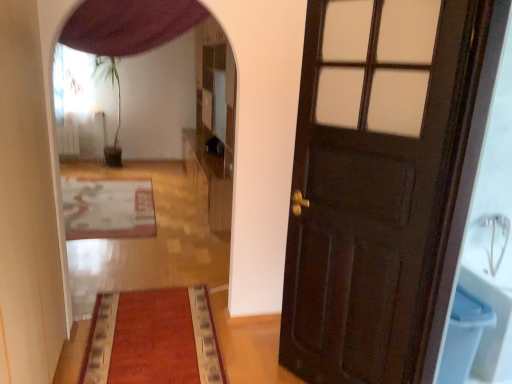
Question: Which direction should I rotate to look at velvet red mat at center, the second mat positioned from the back?

Choices:
 (A) left
 (B) right

Answer: (A)

Question: Does purple fabric curtain at upper center touch wooden dresser at center?

Choices:
 (A) yes
 (B) no

Answer: (B)

Question: Considering the relative sizes of purple fabric curtain at upper center and wooden dresser at center in the image provided, is purple fabric curtain at upper center bigger than wooden dresser at center?

Choices:
 (A) yes
 (B) no

Answer: (B)

Question: Does purple fabric curtain at upper center have a greater height compared to wooden dresser at center?

Choices:
 (A) no
 (B) yes

Answer: (A)

Question: Considering the relative sizes of purple fabric curtain at upper center and wooden dresser at center in the image provided, is purple fabric curtain at upper center shorter than wooden dresser at center?

Choices:
 (A) no
 (B) yes

Answer: (B)

Question: Does purple fabric curtain at upper center have a smaller size compared to wooden dresser at center?

Choices:
 (A) yes
 (B) no

Answer: (A)

Question: Can you confirm if purple fabric curtain at upper center is positioned to the left of wooden dresser at center?

Choices:
 (A) yes
 (B) no

Answer: (A)

Question: Considering the relative positions of wooden dresser at center and dark wood door at right in the image provided, is wooden dresser at center to the left of dark wood door at right from the viewer's perspective?

Choices:
 (A) yes
 (B) no

Answer: (A)

Question: Is there a large distance between wooden dresser at center and dark wood door at right?

Choices:
 (A) yes
 (B) no

Answer: (A)

Question: From a real-world perspective, is wooden dresser at center over dark wood door at right?

Choices:
 (A) yes
 (B) no

Answer: (A)

Question: Does wooden dresser at center have a greater width compared to dark wood door at right?

Choices:
 (A) yes
 (B) no

Answer: (A)

Question: Is wooden dresser at center closer to the viewer compared to dark wood door at right?

Choices:
 (A) yes
 (B) no

Answer: (B)

Question: From the image's perspective, is wooden dresser at center above dark wood door at right?

Choices:
 (A) yes
 (B) no

Answer: (A)

Question: Could you tell me if wooden dresser at center is facing velvet red mat at center, which is counted as the 2th mat, starting from the left?

Choices:
 (A) no
 (B) yes

Answer: (A)